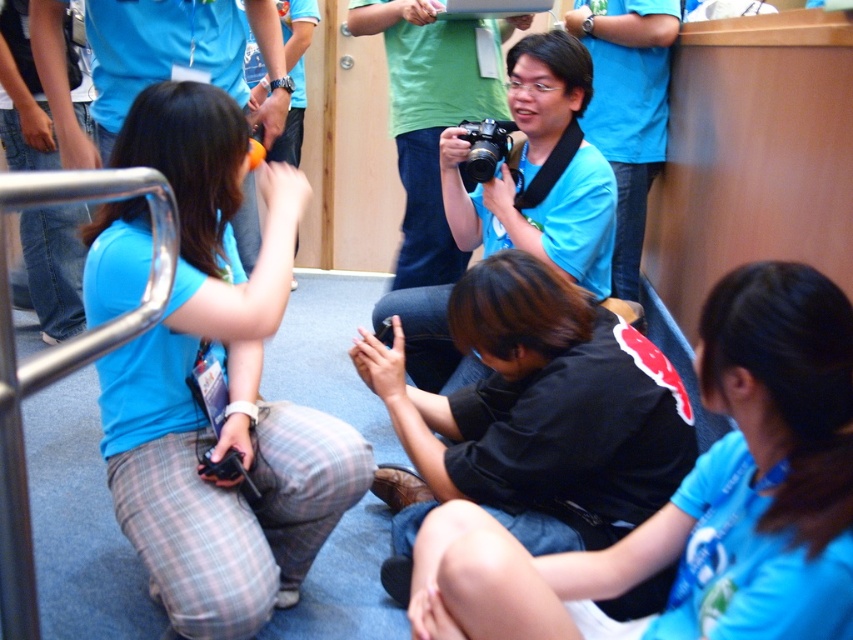
Which is more to the left, black matte shirt at center or matte blue camera at center?

From the viewer's perspective, matte blue camera at center appears more on the left side.

How much distance is there between black matte shirt at center and matte blue camera at center?

3.73 feet

What do you see at coordinates (695, 499) in the screenshot?
I see `black matte shirt at center` at bounding box center [695, 499].

Locate an element on the screen. black matte shirt at center is located at coordinates (695, 499).

What do you see at coordinates (225, 388) in the screenshot? I see `matte blue shirt at left` at bounding box center [225, 388].

Does matte blue shirt at left come behind black plastic camera at center?

No, it is not.

Which is in front, point (177, 499) or point (492, 150)?

Point (177, 499) is in front.

Where is `matte blue shirt at left`? The image size is (853, 640). matte blue shirt at left is located at coordinates (225, 388).

From the picture: Does matte blue shirt at left come in front of black matte shirt at center?

No, it is behind black matte shirt at center.

Is matte blue shirt at left below black matte shirt at center?

Actually, matte blue shirt at left is above black matte shirt at center.

Is point (265, 410) more distant than point (811, 374)?

Yes, it is.

At what (x,y) coordinates should I click in order to perform the action: click on matte blue shirt at left. Please return your answer as a coordinate pair (x, y). Image resolution: width=853 pixels, height=640 pixels. Looking at the image, I should click on (225, 388).